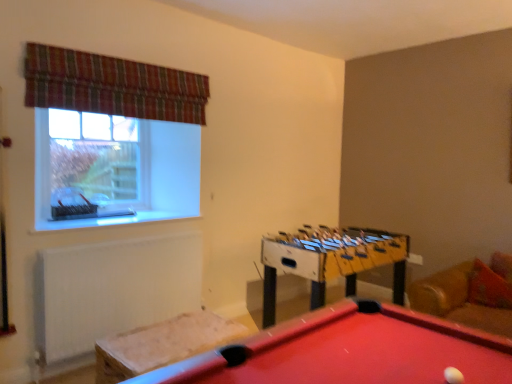
Question: Does point (438, 337) appear closer or farther from the camera than point (170, 72)?

Choices:
 (A) farther
 (B) closer

Answer: (B)

Question: Is rubberized red pool table at lower center in front of or behind plaid fabric curtain at upper left in the image?

Choices:
 (A) front
 (B) behind

Answer: (A)

Question: Which object is positioned farthest from the white matte radiator at lower left?

Choices:
 (A) clear glass window at upper left
 (B) rubberized red pool table at lower center
 (C) yellow plastic foosball table at center
 (D) velvet-like beige cushion at lower left
 (E) white matte ball at lower right

Answer: (E)

Question: Estimate the real-world distances between objects in this image. Which object is closer to the white matte ball at lower right?

Choices:
 (A) clear glass window at upper left
 (B) velvet-like beige cushion at lower left
 (C) matte plastic window sill at upper left
 (D) plaid fabric curtain at upper left
 (E) yellow plastic foosball table at center

Answer: (B)